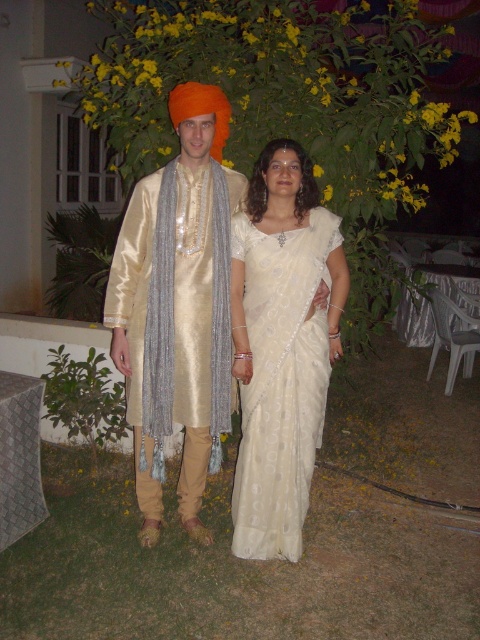
Question: Does silky beige kurta at center lie behind white silk saree at center?

Choices:
 (A) no
 (B) yes

Answer: (A)

Question: Does silky beige kurta at center appear on the right side of white silk saree at center?

Choices:
 (A) yes
 (B) no

Answer: (B)

Question: Which of the following is the farthest from the observer?

Choices:
 (A) silky beige kurta at center
 (B) white silk saree at center

Answer: (B)

Question: Which point appears closest to the camera in this image?

Choices:
 (A) (295, 365)
 (B) (298, 499)

Answer: (A)

Question: Is silky beige kurta at center to the left of white silk saree at center from the viewer's perspective?

Choices:
 (A) no
 (B) yes

Answer: (B)

Question: Which point is closer to the camera taking this photo?

Choices:
 (A) (120, 228)
 (B) (303, 428)

Answer: (B)